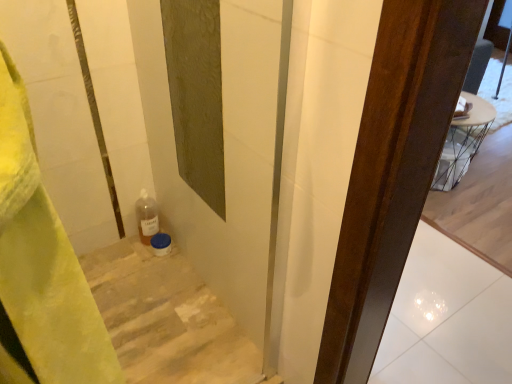
Question: Considering the relative positions of white glossy tile at center and wooden stairs at lower left in the image provided, is white glossy tile at center to the left of wooden stairs at lower left from the viewer's perspective?

Choices:
 (A) no
 (B) yes

Answer: (A)

Question: Considering the relative sizes of white glossy tile at center and wooden stairs at lower left in the image provided, is white glossy tile at center wider than wooden stairs at lower left?

Choices:
 (A) no
 (B) yes

Answer: (B)

Question: From a real-world perspective, is white glossy tile at center under wooden stairs at lower left?

Choices:
 (A) yes
 (B) no

Answer: (A)

Question: Would you say white glossy tile at center is a long distance from wooden stairs at lower left?

Choices:
 (A) no
 (B) yes

Answer: (A)

Question: Can you confirm if white glossy tile at center is taller than wooden stairs at lower left?

Choices:
 (A) no
 (B) yes

Answer: (A)

Question: Considering the relative positions of white glossy tile at center and wooden stairs at lower left in the image provided, is white glossy tile at center to the right of wooden stairs at lower left from the viewer's perspective?

Choices:
 (A) yes
 (B) no

Answer: (A)

Question: Considering the relative sizes of wooden stairs at lower left and white glossy tile at center in the image provided, is wooden stairs at lower left thinner than white glossy tile at center?

Choices:
 (A) no
 (B) yes

Answer: (B)

Question: Is wooden stairs at lower left shorter than white glossy tile at center?

Choices:
 (A) no
 (B) yes

Answer: (A)

Question: Considering the relative sizes of wooden stairs at lower left and white glossy tile at center in the image provided, is wooden stairs at lower left wider than white glossy tile at center?

Choices:
 (A) yes
 (B) no

Answer: (B)

Question: Does wooden stairs at lower left have a larger size compared to white glossy tile at center?

Choices:
 (A) no
 (B) yes

Answer: (B)

Question: Is wooden stairs at lower left further to the viewer compared to white glossy tile at center?

Choices:
 (A) no
 (B) yes

Answer: (A)

Question: From a real-world perspective, is wooden stairs at lower left on white glossy tile at center?

Choices:
 (A) no
 (B) yes

Answer: (B)

Question: Which is correct: wooden stairs at lower left is inside white glossy tile at center, or outside of it?

Choices:
 (A) inside
 (B) outside

Answer: (B)